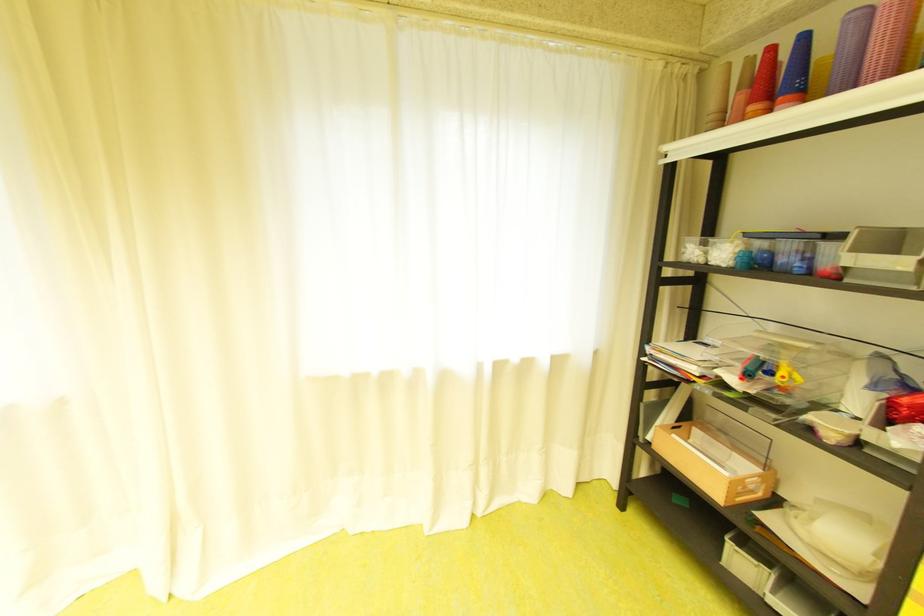
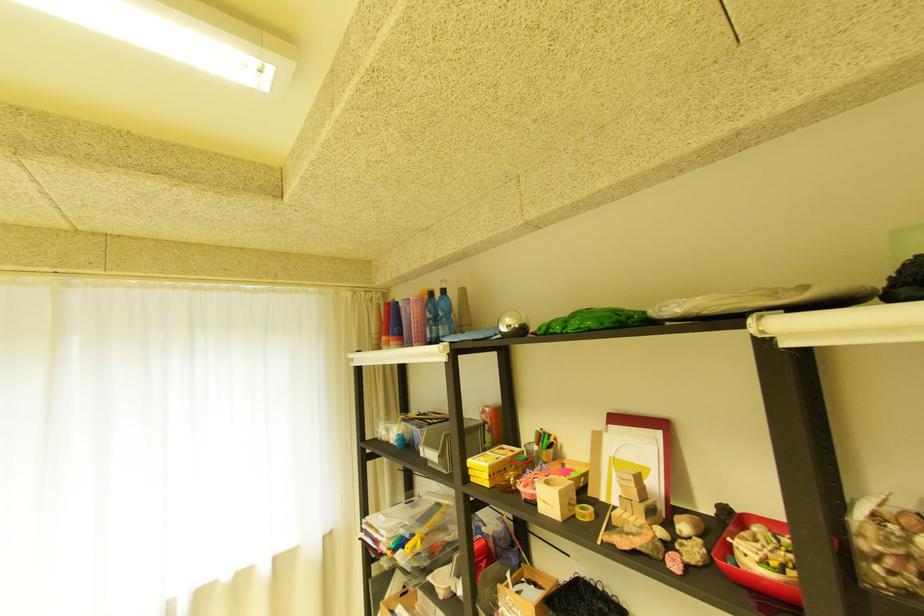
Based on the continuous images, in which direction is the camera rotating?

The rotation direction of the camera is right-up.